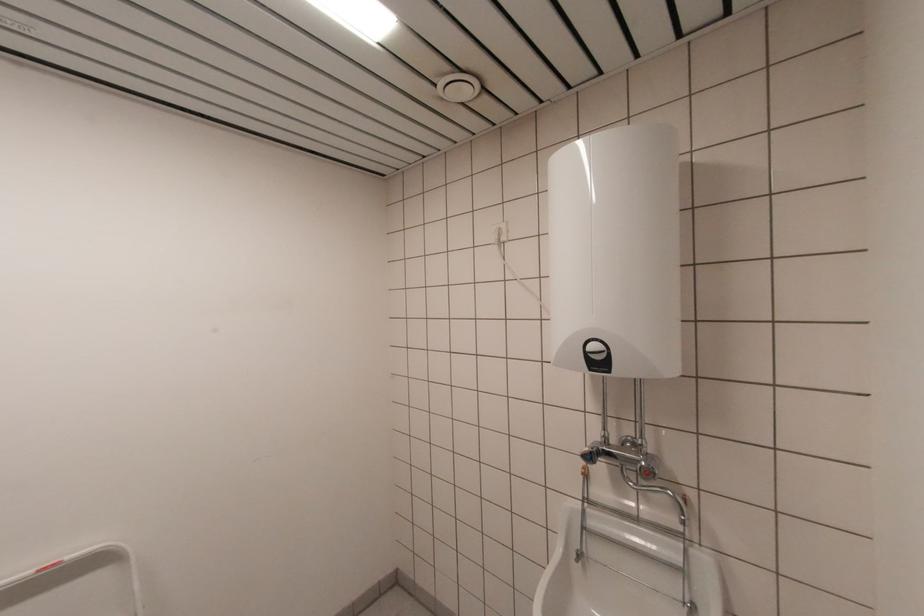
Find where to turn the red valve handle. Please return your answer as a coordinate pair (x, y).

(649, 471)